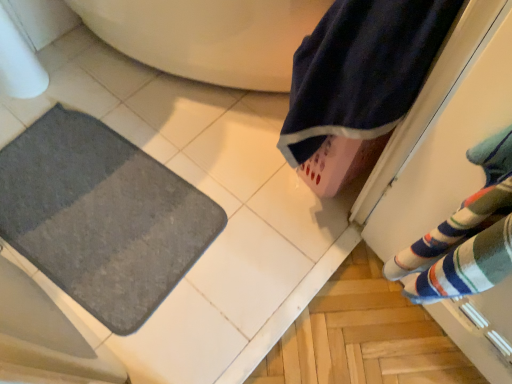
Question: Is the depth of gray soft mat at lower left greater than that of navy blue towel at upper right?

Choices:
 (A) yes
 (B) no

Answer: (A)

Question: Does gray soft mat at lower left appear on the right side of navy blue towel at upper right?

Choices:
 (A) no
 (B) yes

Answer: (A)

Question: Is gray soft mat at lower left far away from navy blue towel at upper right?

Choices:
 (A) no
 (B) yes

Answer: (A)

Question: From the image's perspective, is gray soft mat at lower left on navy blue towel at upper right?

Choices:
 (A) yes
 (B) no

Answer: (B)

Question: Is gray soft mat at lower left not within navy blue towel at upper right?

Choices:
 (A) yes
 (B) no

Answer: (A)

Question: Is gray soft mat at lower left facing away from navy blue towel at upper right?

Choices:
 (A) no
 (B) yes

Answer: (A)

Question: Is the surface of navy blue towel at upper right in direct contact with gray soft mat at lower left?

Choices:
 (A) no
 (B) yes

Answer: (A)

Question: From a real-world perspective, is navy blue towel at upper right below gray soft mat at lower left?

Choices:
 (A) no
 (B) yes

Answer: (A)

Question: Considering the relative sizes of navy blue towel at upper right and gray soft mat at lower left in the image provided, is navy blue towel at upper right wider than gray soft mat at lower left?

Choices:
 (A) no
 (B) yes

Answer: (A)

Question: Can you confirm if navy blue towel at upper right is thinner than gray soft mat at lower left?

Choices:
 (A) yes
 (B) no

Answer: (A)

Question: Would you say gray soft mat at lower left is part of navy blue towel at upper right's contents?

Choices:
 (A) yes
 (B) no

Answer: (B)

Question: Would you say navy blue towel at upper right is outside gray soft mat at lower left?

Choices:
 (A) yes
 (B) no

Answer: (A)

Question: In the image, is gray soft mat at lower left on the left side or the right side of navy blue towel at upper right?

Choices:
 (A) right
 (B) left

Answer: (B)